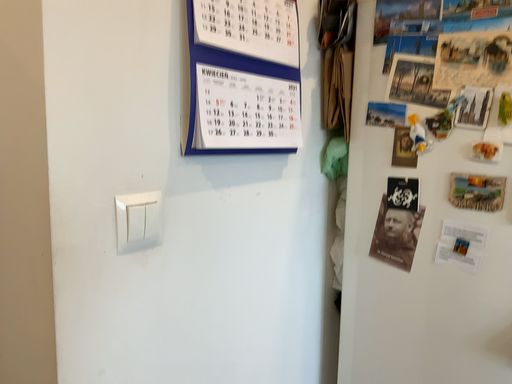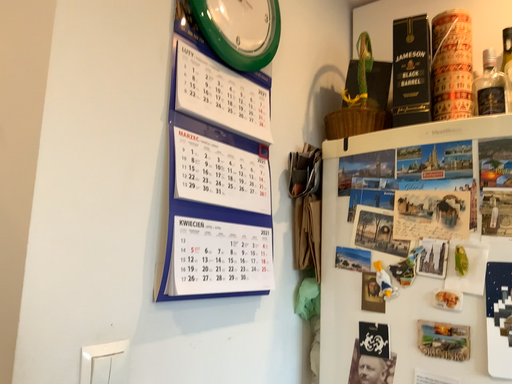
Question: Which way did the camera rotate in the video?

Choices:
 (A) rotated downward
 (B) rotated upward

Answer: (B)